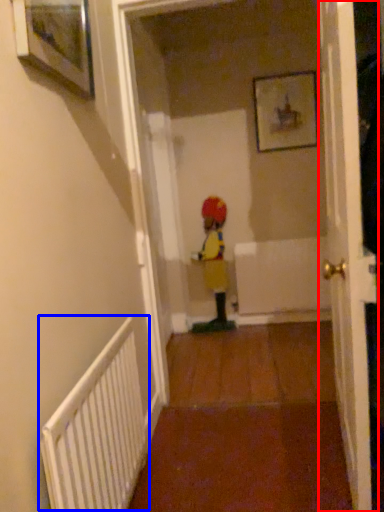
Question: Among these objects, which one is nearest to the camera, door (highlighted by a red box) or radiator (highlighted by a blue box)?

Choices:
 (A) door
 (B) radiator

Answer: (B)